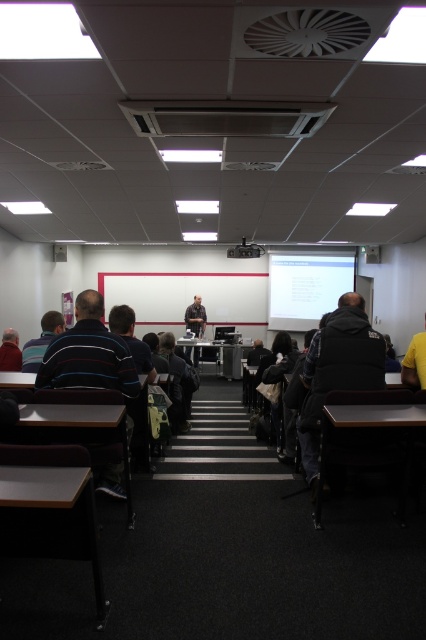
You are a student sitting at the striped shirt at lower left and need to reach the metallic silver table at center to turn off the laptop. Can you walk directly to the table without moving any other objects?

The metallic silver table at center is 19.15 feet away from striped shirt at lower left. Since the path is clear of other objects, the student can walk directly to the table to turn off the laptop.

You are sitting at a desk in the classroom and want to see the presentation clearly. Where is the best position to sit so that you have an unobstructed view of the white glossy projector screen at upper right?

The best position to sit would be directly facing the white glossy projector screen at upper right, which is located at point (305, 288). This ensures an unobstructed view of the screen.